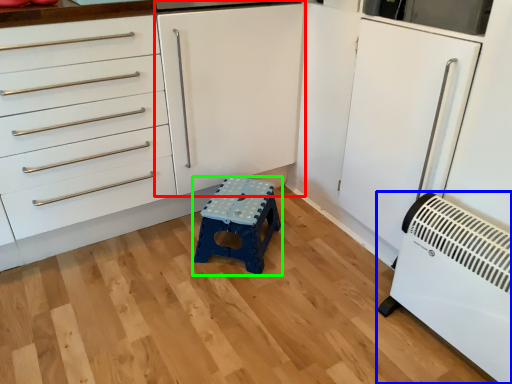
Question: Considering the real-world distances, which object is closest to cabinetry (highlighted by a red box)? home appliance (highlighted by a blue box) or furniture (highlighted by a green box).

Choices:
 (A) home appliance
 (B) furniture

Answer: (B)